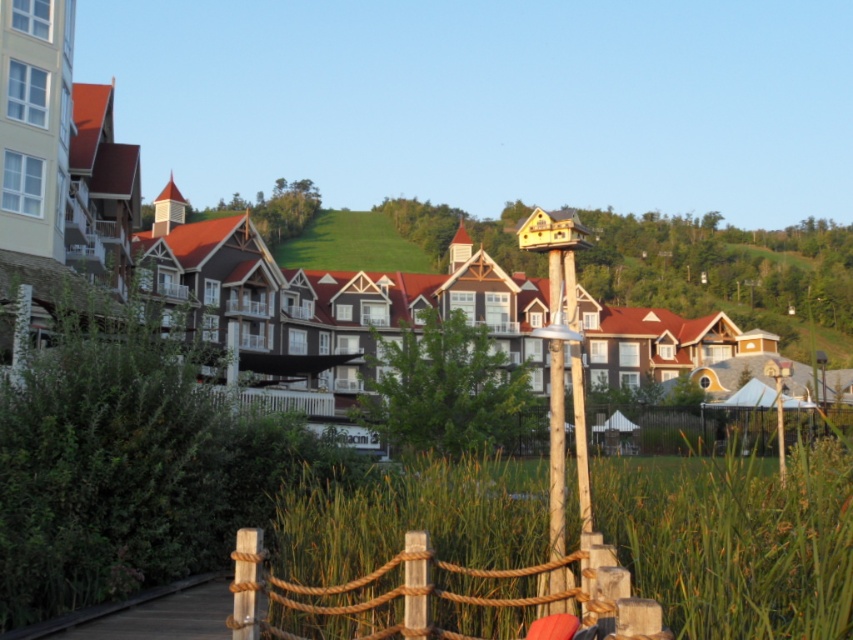
You are a painter standing on the wooden walkway and want to paint both the brown wooden fence at center and the wooden post at center. Which object should you focus on first if you want to paint the taller one first?

The wooden post at center is taller than the brown wooden fence at center, so you should focus on painting the wooden post at center first.

You are a visitor standing on the wooden walkway and want to take a photo of the brown wooden houses at center and the wooden post at center. Which object will appear larger in the photo?

The brown wooden houses at center will appear larger in the photo because they are much taller than the wooden post at center.

You are standing on the wooden walkway and want to reach the brown wooden houses at center. Which direction should you walk relative to the rope wood at center?

You should walk to the right of the rope wood at center to reach the brown wooden houses at center since the brown wooden houses at center is located to the right of the rope wood at center.